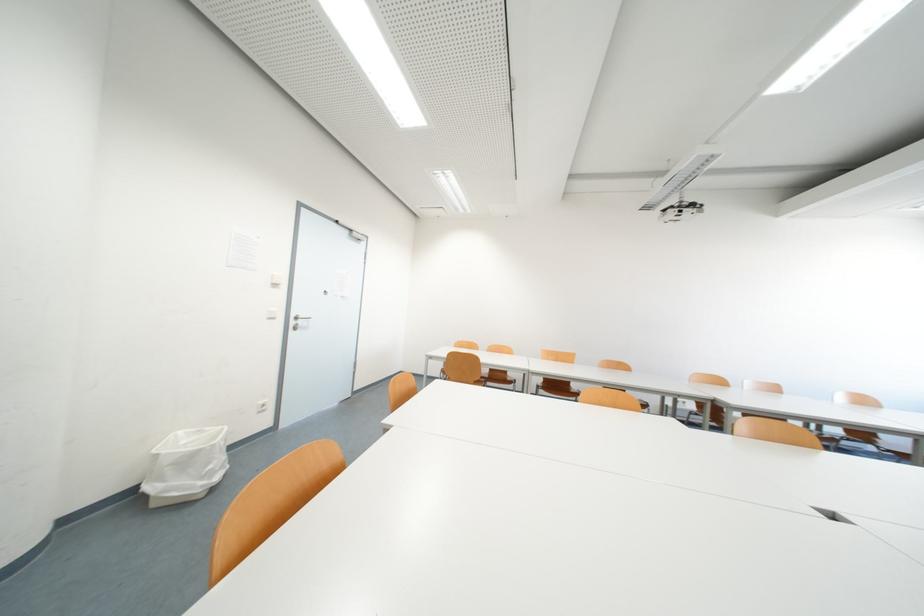
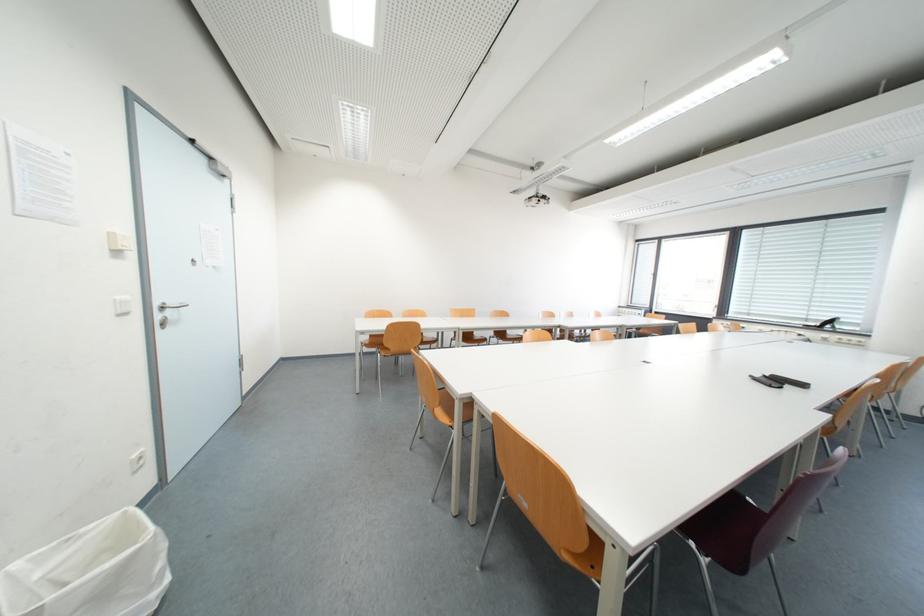
In the second image, find the point that corresponds to point 197,463 in the first image.

(123, 585)